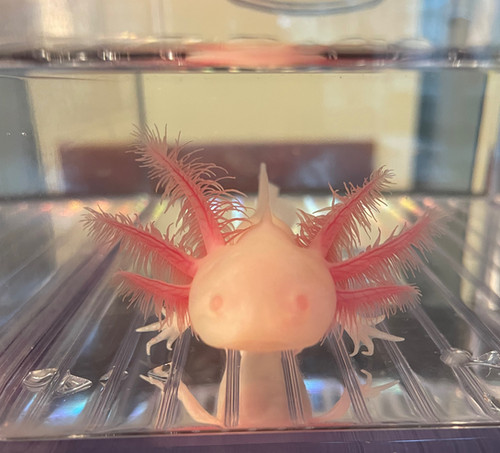
Find the location of a particular element. This screenshot has height=453, width=500. wall is located at coordinates (393, 131).